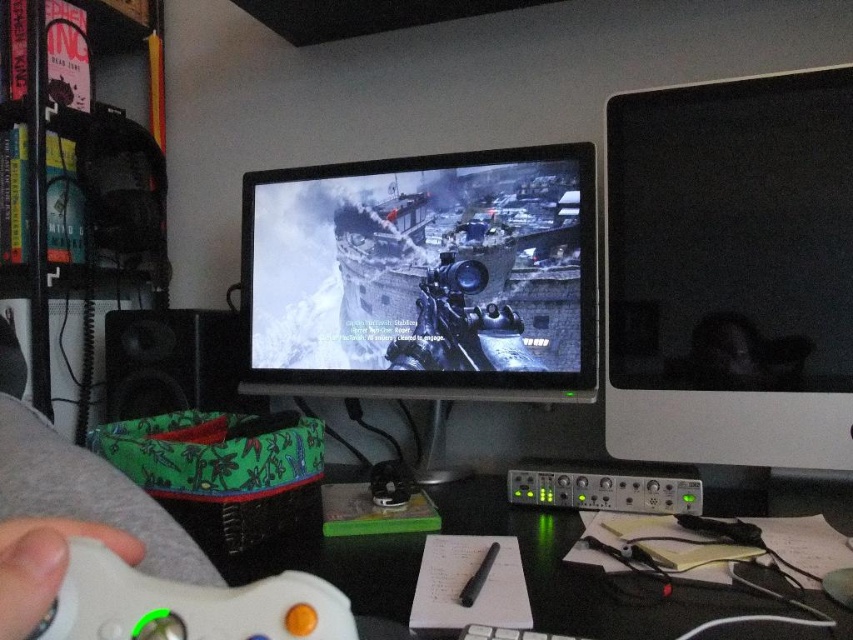
Question: Where is black plastic computer desk at center located in relation to white matte game controller at lower left in the image?

Choices:
 (A) below
 (B) above

Answer: (A)

Question: Which of the following is the closest to the observer?

Choices:
 (A) white matte game controller at lower left
 (B) black glossy monitor at right
 (C) white matte controller at lower left

Answer: (C)

Question: Which is nearer to the black plastic computer desk at center?

Choices:
 (A) black glossy monitor at right
 (B) white matte controller at lower left
 (C) white matte game controller at lower left
 (D) matte black monitor at center

Answer: (A)

Question: Can you confirm if black glossy monitor at right is smaller than black plastic computer desk at center?

Choices:
 (A) yes
 (B) no

Answer: (B)

Question: Which of the following is the farthest from the observer?

Choices:
 (A) (161, 596)
 (B) (514, 372)
 (C) (641, 256)

Answer: (B)

Question: Is matte black monitor at center below black plastic computer desk at center?

Choices:
 (A) no
 (B) yes

Answer: (A)